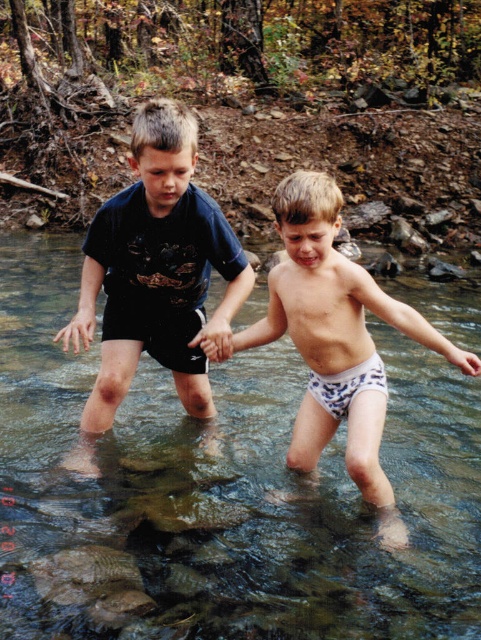
Question: Which of these objects is positioned farthest from the clear water stream at center?

Choices:
 (A) white printed shorts at center
 (B) dark blue cotton shorts at center

Answer: (A)

Question: Which point appears farthest from the camera in this image?

Choices:
 (A) (262, 339)
 (B) (101, 408)
 (C) (213, 499)

Answer: (C)

Question: Which object is positioned closest to the white printed shorts at center?

Choices:
 (A) clear water stream at center
 (B) dark blue cotton shorts at center

Answer: (B)

Question: Is clear water stream at center smaller than white printed shorts at center?

Choices:
 (A) yes
 (B) no

Answer: (A)

Question: Does clear water stream at center appear on the left side of dark blue cotton shorts at center?

Choices:
 (A) no
 (B) yes

Answer: (B)

Question: Does clear water stream at center appear on the left side of white printed shorts at center?

Choices:
 (A) yes
 (B) no

Answer: (A)